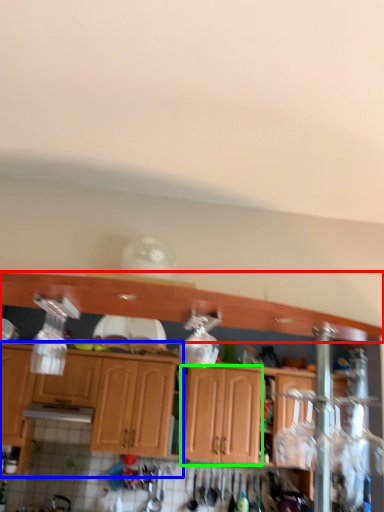
Question: Which object is positioned closest to cabinetry (highlighted by a red box)? Select from cabinetry (highlighted by a blue box) and cabinetry (highlighted by a green box).

Choices:
 (A) cabinetry
 (B) cabinetry

Answer: (A)